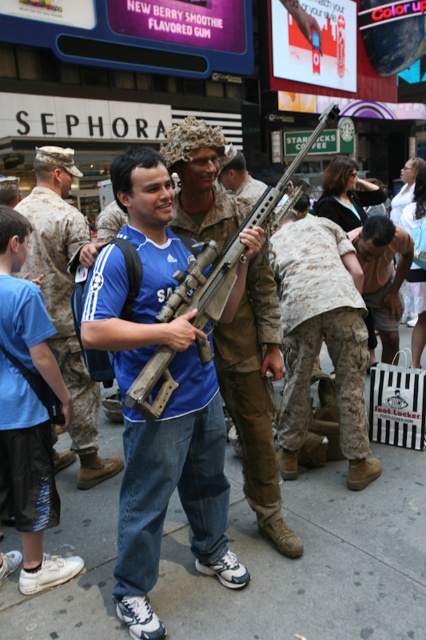
Question: Can you confirm if blue jersey at center is thinner than matte brown shotgun at center?

Choices:
 (A) yes
 (B) no

Answer: (A)

Question: Among these points, which one is farthest from the camera?

Choices:
 (A) (60, 593)
 (B) (293, 259)
 (C) (219, 305)

Answer: (B)

Question: Does black mesh shorts at lower left appear on the right side of matte brown shotgun at center?

Choices:
 (A) yes
 (B) no

Answer: (B)

Question: Is gray concrete pavement at center positioned behind matte brown shotgun at center?

Choices:
 (A) no
 (B) yes

Answer: (B)

Question: Which point is farther to the camera?

Choices:
 (A) gray concrete pavement at center
 (B) camouflage uniform at center
 (C) matte brown shotgun at center

Answer: (B)

Question: Among these objects, which one is farthest from the camera?

Choices:
 (A) black mesh shorts at lower left
 (B) blue jersey at center
 (C) camouflage fabric pants at center
 (D) gray concrete pavement at center

Answer: (B)